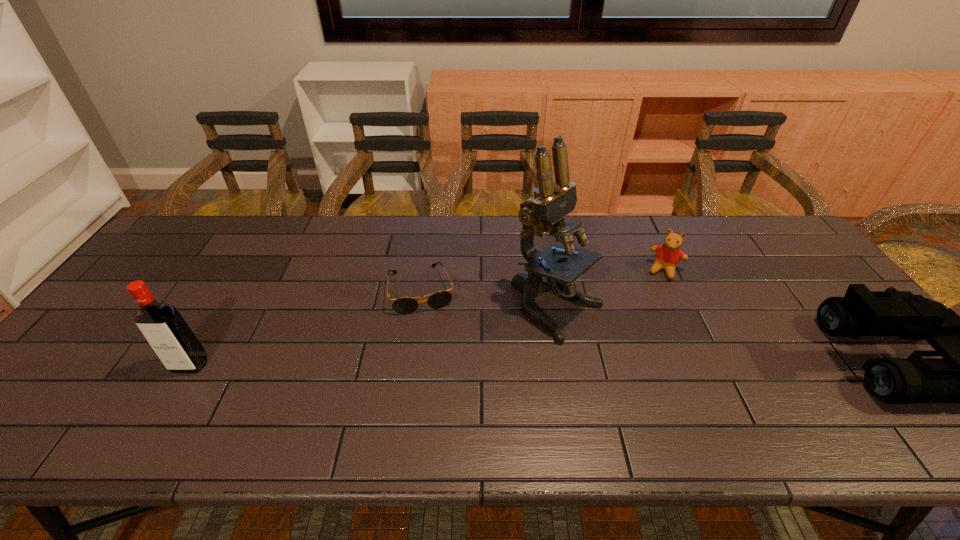
This screenshot has height=540, width=960. I want to click on the second tallest object, so click(171, 338).

This screenshot has width=960, height=540. What are the coordinates of `vodka` in the screenshot? It's located at (171, 338).

The height and width of the screenshot is (540, 960). I want to click on the second shortest object, so click(668, 255).

Find the location of a particular element. the fourth object from left to right is located at coordinates (668, 255).

I want to click on the shortest object, so click(x=406, y=305).

Find the location of a particular element. The height and width of the screenshot is (540, 960). sunglasses is located at coordinates (406, 305).

Find the location of a particular element. This screenshot has width=960, height=540. microscope is located at coordinates (545, 212).

Locate an element on the screen. This screenshot has width=960, height=540. the third object from right to left is located at coordinates (545, 212).

At what (x,y) coordinates should I click in order to perform the action: click on free point located on the front and back of the leftmost object. Please return your answer as a coordinate pair (x, y). The width and height of the screenshot is (960, 540). Looking at the image, I should click on (174, 393).

Locate an element on the screen. The height and width of the screenshot is (540, 960). vacant space located 0.330m on the front-facing side of the second object from right to left is located at coordinates (634, 360).